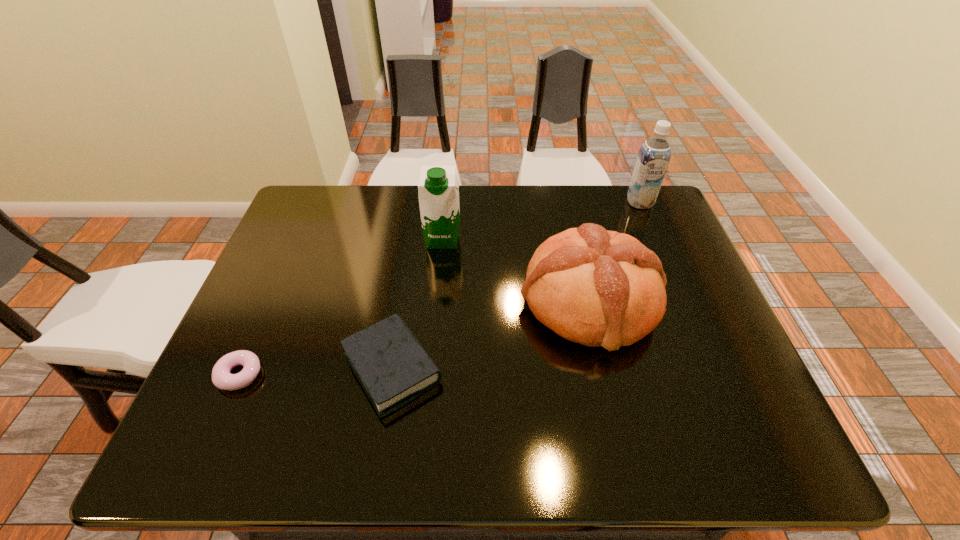
The height and width of the screenshot is (540, 960). In order to click on vacant area that lies between the right soya milk and the second shortest object in this screenshot , I will do `click(516, 285)`.

The width and height of the screenshot is (960, 540). What are the coordinates of `object identified as the closest to the fourth object from left to right` in the screenshot? It's located at (438, 188).

At what (x,y) coordinates should I click in order to perform the action: click on the third closest object relative to the Bible. Please return your answer as a coordinate pair (x, y). Image resolution: width=960 pixels, height=540 pixels. Looking at the image, I should click on (438, 188).

This screenshot has height=540, width=960. I want to click on free space in the image that satisfies the following two spatial constraints: 1. on the back side of the fourth object from left to right; 2. on the right side of the Bible, so click(403, 301).

Image resolution: width=960 pixels, height=540 pixels. What are the coordinates of `blank space that satisfies the following two spatial constraints: 1. on the front-facing side of the fourth nearest object; 2. on the right side of the third tallest object` in the screenshot? It's located at (437, 301).

This screenshot has width=960, height=540. In order to click on vacant point that satisfies the following two spatial constraints: 1. on the front-facing side of the second farthest object; 2. on the right side of the fourth object from left to right in this screenshot , I will do `click(437, 301)`.

This screenshot has width=960, height=540. In order to click on free point that satisfies the following two spatial constraints: 1. on the front-facing side of the bread; 2. on the left side of the nearer soya milk in this screenshot , I will do `click(437, 301)`.

I want to click on vacant point that satisfies the following two spatial constraints: 1. on the back side of the leftmost object; 2. on the right side of the second object from right to left, so click(272, 301).